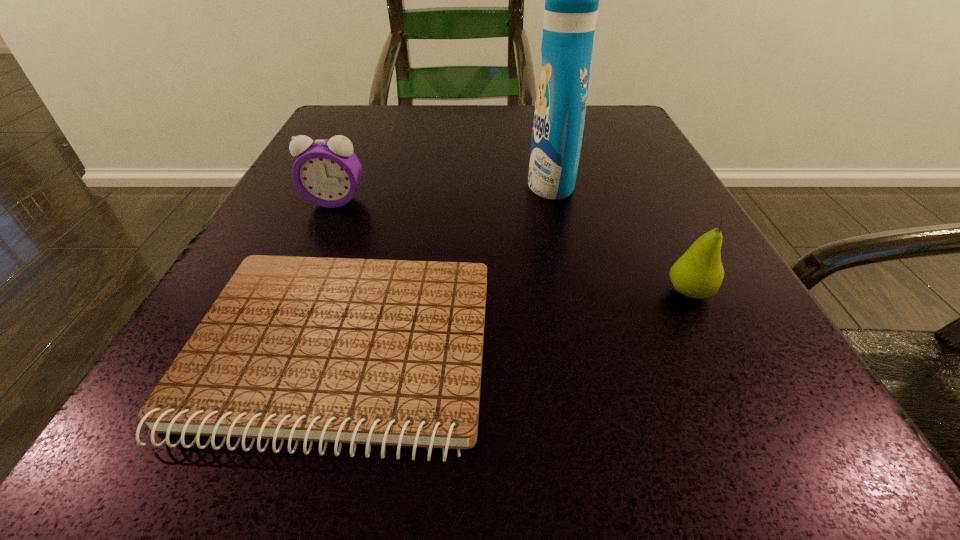
Where is `free space at the far right corner of the desktop`? free space at the far right corner of the desktop is located at coordinates (649, 143).

You are a GUI agent. You are given a task and a screenshot of the screen. Output one action in this format:
    pyautogui.click(x=<x>, y=<y>)
    Task: Click on the free spot at the near right corner of the desktop
    
    Given the screenshot: What is the action you would take?
    pyautogui.click(x=674, y=464)

Identify the location of unoccupied position between the tallest object and the alarm clock. (443, 193).

This screenshot has height=540, width=960. Identify the location of vacant area between the shortest object and the rightmost object. (516, 322).

Find the location of `free point between the alarm clock and the tallest object`. free point between the alarm clock and the tallest object is located at coordinates (443, 193).

Identify the location of vacant space in between the rightmost object and the tallest object. The width and height of the screenshot is (960, 540). (x=620, y=238).

Find the location of a particular element. vacant area that lies between the alarm clock and the pear is located at coordinates (512, 247).

Where is `free space between the notebook and the rightmost object`? free space between the notebook and the rightmost object is located at coordinates (516, 322).

Identify the location of free spot between the rightmost object and the alarm clock. (512, 247).

The height and width of the screenshot is (540, 960). Identify the location of unoccupied area between the rightmost object and the alarm clock. (512, 247).